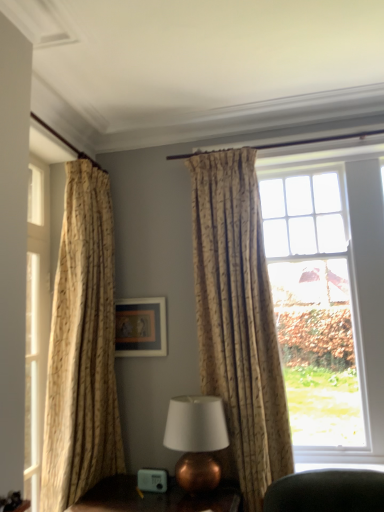
Question: Is copper metallic table lamp at lower center wider than copper metallic table lamp at center?

Choices:
 (A) yes
 (B) no

Answer: (A)

Question: Is copper metallic table lamp at lower center at the left side of copper metallic table lamp at center?

Choices:
 (A) yes
 (B) no

Answer: (A)

Question: Could you tell me if copper metallic table lamp at lower center is turned towards copper metallic table lamp at center?

Choices:
 (A) no
 (B) yes

Answer: (A)

Question: From the image's perspective, is copper metallic table lamp at lower center below copper metallic table lamp at center?

Choices:
 (A) no
 (B) yes

Answer: (B)

Question: Is copper metallic table lamp at lower center next to copper metallic table lamp at center?

Choices:
 (A) yes
 (B) no

Answer: (B)

Question: From a real-world perspective, is copper metallic table lamp at lower center over copper metallic table lamp at center?

Choices:
 (A) yes
 (B) no

Answer: (B)

Question: Is beige textured curtain at center, which is the first curtain from right to left, far away from beige textured curtain at left, marked as the 1th curtain in a left-to-right arrangement?

Choices:
 (A) no
 (B) yes

Answer: (A)

Question: Does beige textured curtain at center, which is the 2th curtain in left-to-right order, have a lesser height compared to beige textured curtain at left, marked as the 1th curtain in a left-to-right arrangement?

Choices:
 (A) yes
 (B) no

Answer: (A)

Question: Does beige textured curtain at center, which is the 2th curtain in left-to-right order, appear on the left side of beige textured curtain at left, the 2th curtain viewed from the right?

Choices:
 (A) no
 (B) yes

Answer: (A)

Question: Can you confirm if beige textured curtain at center, which is the first curtain from right to left, is taller than beige textured curtain at left, the 2th curtain viewed from the right?

Choices:
 (A) yes
 (B) no

Answer: (B)

Question: From the image's perspective, is beige textured curtain at center, which is the 2th curtain in left-to-right order, under beige textured curtain at left, marked as the 1th curtain in a left-to-right arrangement?

Choices:
 (A) yes
 (B) no

Answer: (B)

Question: Is beige textured curtain at center, which is the first curtain from right to left, at the right side of beige textured curtain at left, marked as the 1th curtain in a left-to-right arrangement?

Choices:
 (A) no
 (B) yes

Answer: (B)

Question: From a real-world perspective, does beige textured curtain at left, the 2th curtain viewed from the right, stand above copper metallic table lamp at center?

Choices:
 (A) no
 (B) yes

Answer: (B)